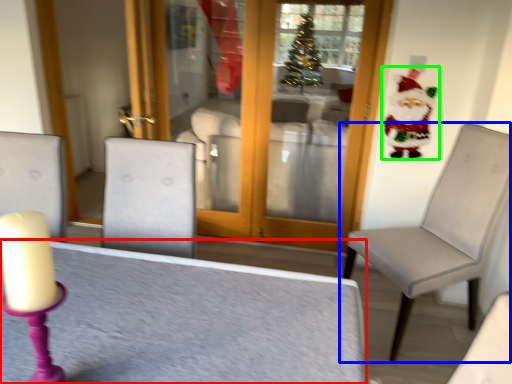
Question: Estimate the real-world distances between objects in this image. Which object is closer to table (highlighted by a red box), chair (highlighted by a blue box) or santa claus (highlighted by a green box)?

Choices:
 (A) chair
 (B) santa claus

Answer: (A)